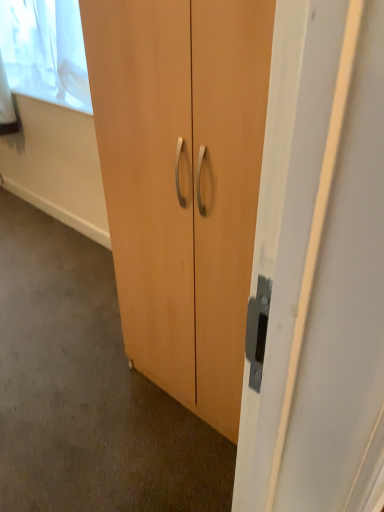
Question: In the image, is white sheer curtain at upper left on the left side or the right side of matte wood cupboard at center?

Choices:
 (A) right
 (B) left

Answer: (B)

Question: From a real-world perspective, is white sheer curtain at upper left above or below matte wood cupboard at center?

Choices:
 (A) above
 (B) below

Answer: (A)

Question: Which object is the closest to the matte wood cabinet at center?

Choices:
 (A) white sheer curtain at upper left
 (B) matte wood cupboard at center

Answer: (B)

Question: Estimate the real-world distances between objects in this image. Which object is farther from the matte wood cabinet at center?

Choices:
 (A) white sheer curtain at upper left
 (B) matte wood cupboard at center

Answer: (A)